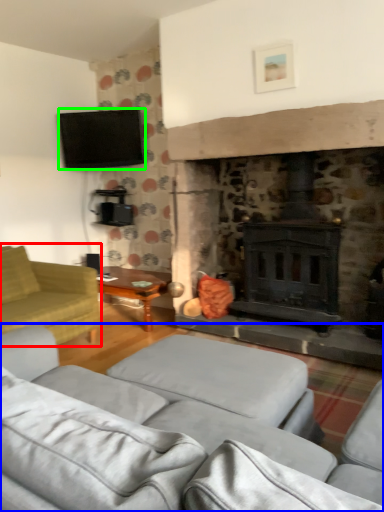
Question: Considering the real-world distances, which object is farthest from studio couch (highlighted by a red box)? studio couch (highlighted by a blue box) or television (highlighted by a green box)?

Choices:
 (A) studio couch
 (B) television

Answer: (B)